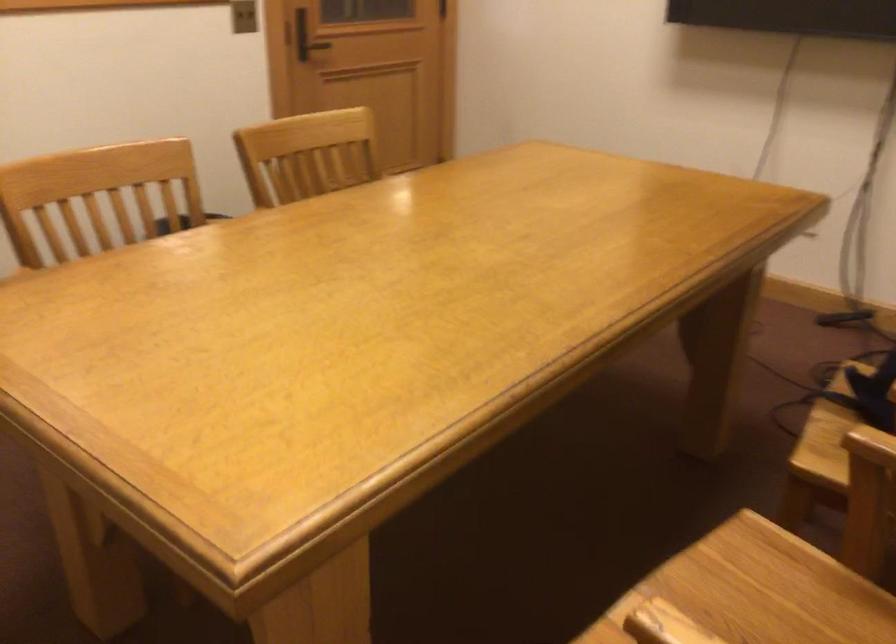
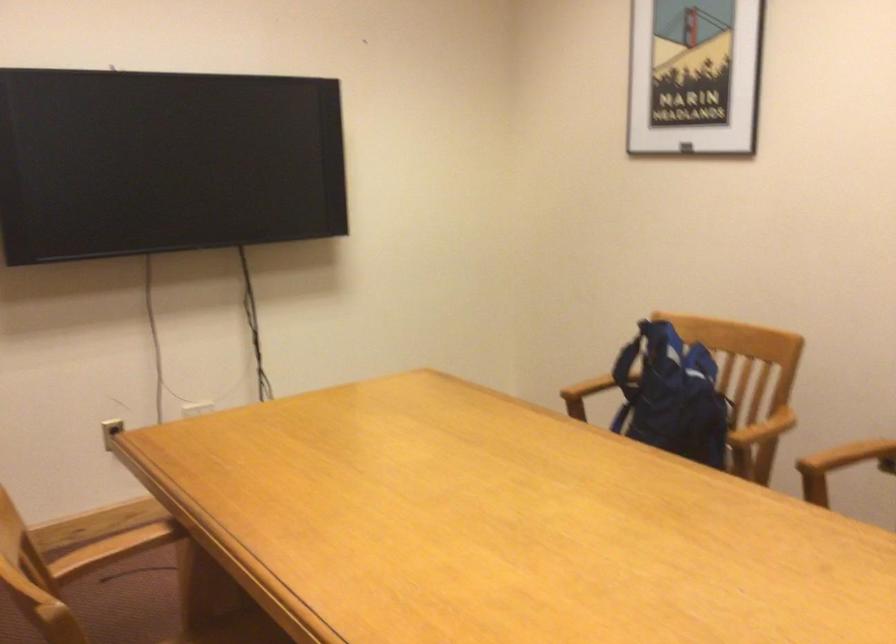
Question: I am providing you with two images of the same scene from different viewpoints. Which of the following objects are not visible in image2?

Choices:
 (A) metal tumbler
 (B) chair sitting surface
 (C) wooden chair armrest
 (D) blue backpack

Answer: (B)